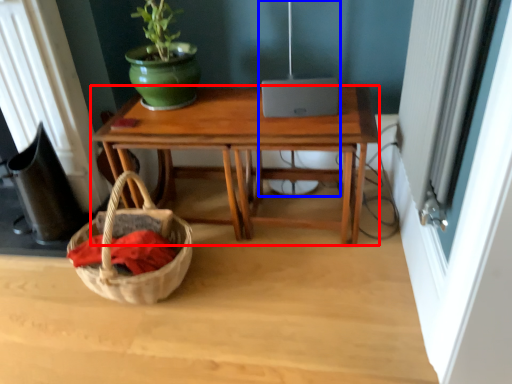
Question: Which object is further to the camera taking this photo, desk (highlighted by a red box) or lamp (highlighted by a blue box)?

Choices:
 (A) desk
 (B) lamp

Answer: (B)